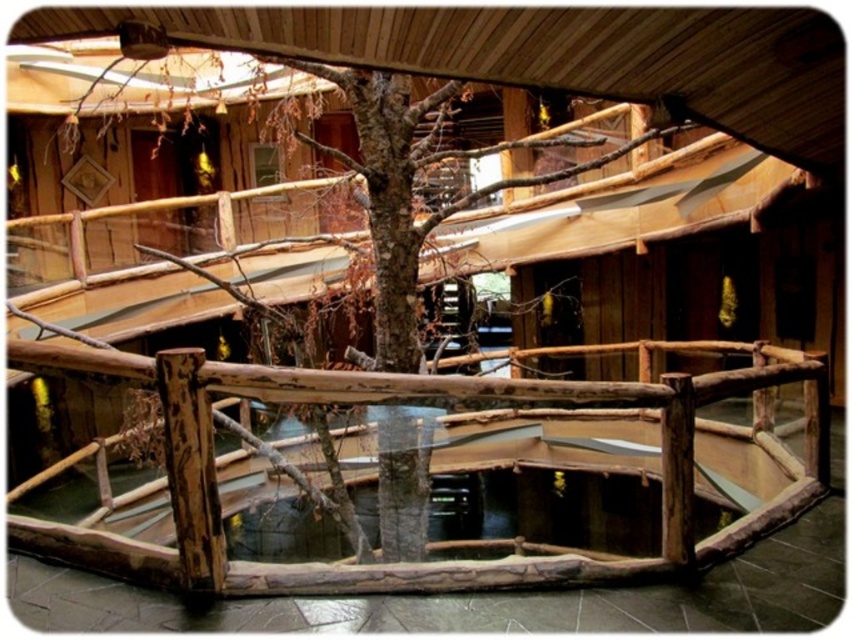
You are a maintenance worker needing to inspect the natural wood railing at center and the brown rough wood tree at center. You have a 2.5 meter ladder. Can you safely reach both objects with your ladder?

The natural wood railing at center is 2.59 meters from the brown rough wood tree at center. Since the ladder is only 2.5 meters long, it is 9 centimeters too short to reach both objects safely. You need a longer ladder.

You are standing on the floor near the natural wood railing at center and want to touch the brown rough wood tree at center. Which direction should you move to reach the tree?

The natural wood railing at center is below the brown rough wood tree at center, so you should move upward to reach the tree.

You are an interior designer planning to place a large potted plant between the natural wood railing at center and the brown rough wood tree at center. Based on their widths, which object should the plant be placed closer to?

The natural wood railing at center might be wider than the brown rough wood tree at center, so the plant should be placed closer to the natural wood railing at center to accommodate its width.